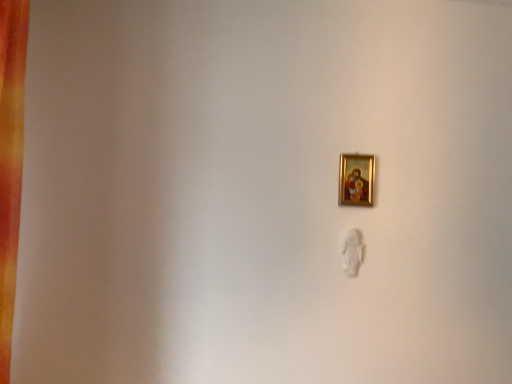
The height and width of the screenshot is (384, 512). I want to click on gold-framed painting at upper center, so click(x=356, y=179).

The width and height of the screenshot is (512, 384). Describe the element at coordinates (356, 179) in the screenshot. I see `gold-framed painting at upper center` at that location.

This screenshot has height=384, width=512. In order to click on gold-framed painting at upper center in this screenshot , I will do `click(356, 179)`.